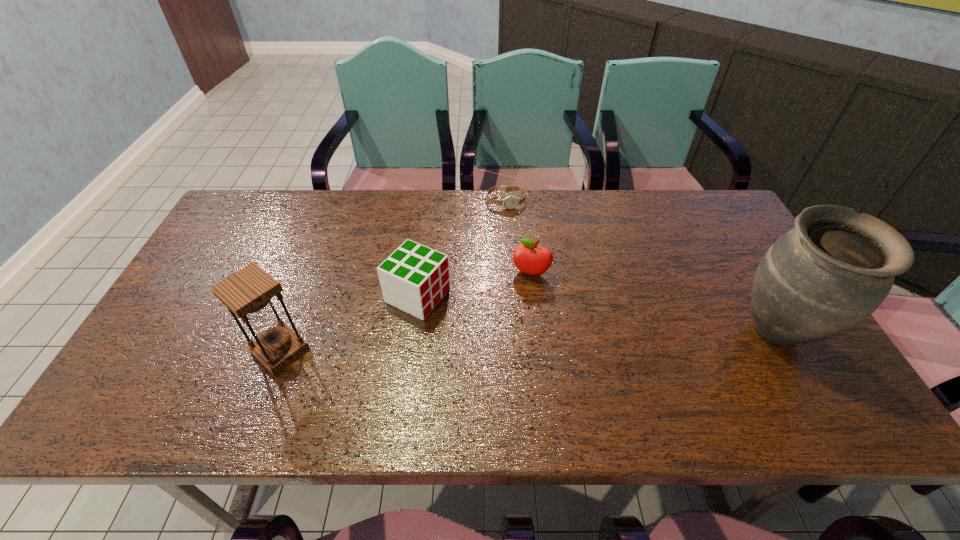
What are the coordinates of `the leftmost object` in the screenshot? It's located at (247, 293).

Locate an element on the screen. Image resolution: width=960 pixels, height=540 pixels. the second tallest object is located at coordinates (247, 293).

Where is `urn`? This screenshot has width=960, height=540. urn is located at coordinates (830, 272).

Where is `the rightmost object`? The width and height of the screenshot is (960, 540). the rightmost object is located at coordinates (830, 272).

This screenshot has height=540, width=960. I want to click on the farthest object, so click(510, 202).

Find the location of a particular element. The image size is (960, 540). watch is located at coordinates (510, 202).

Where is `apple`? This screenshot has height=540, width=960. apple is located at coordinates (529, 258).

You are a GUI agent. You are given a task and a screenshot of the screen. Output one action in this format:
    pyautogui.click(x=<x>, y=<y>)
    Task: Click on the cube
    The image size is (960, 540).
    Given the screenshot: What is the action you would take?
    pyautogui.click(x=414, y=278)

In order to click on vacant point located 0.100m on the left of the fourth shortest object in this screenshot , I will do `click(209, 350)`.

What are the coordinates of `free location located on the back of the rightmost object` in the screenshot? It's located at pyautogui.click(x=722, y=236).